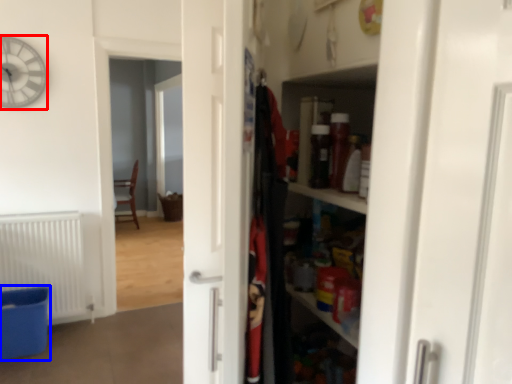
Question: Which object appears farthest to the camera in this image, clock (highlighted by a red box) or laundry basket (highlighted by a blue box)?

Choices:
 (A) clock
 (B) laundry basket

Answer: (A)